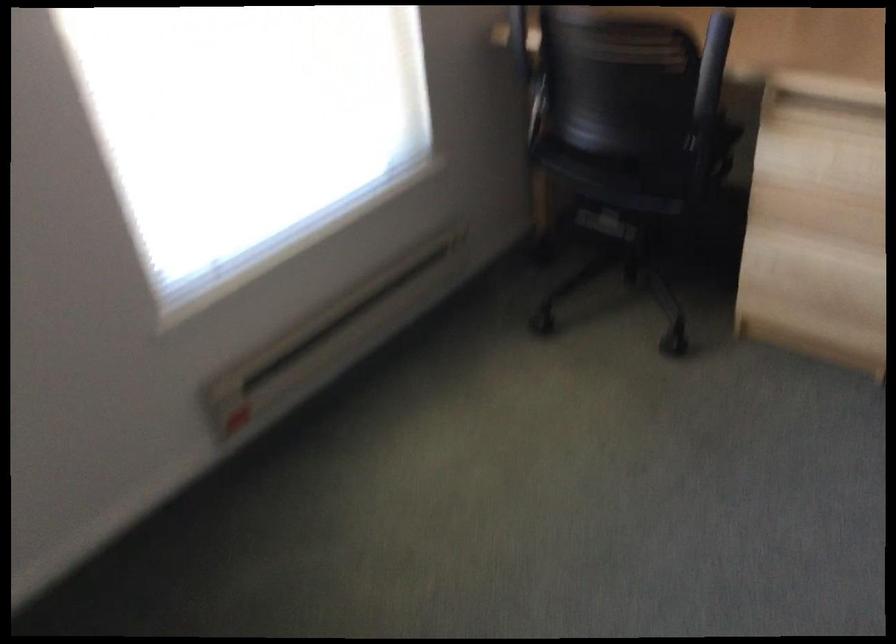
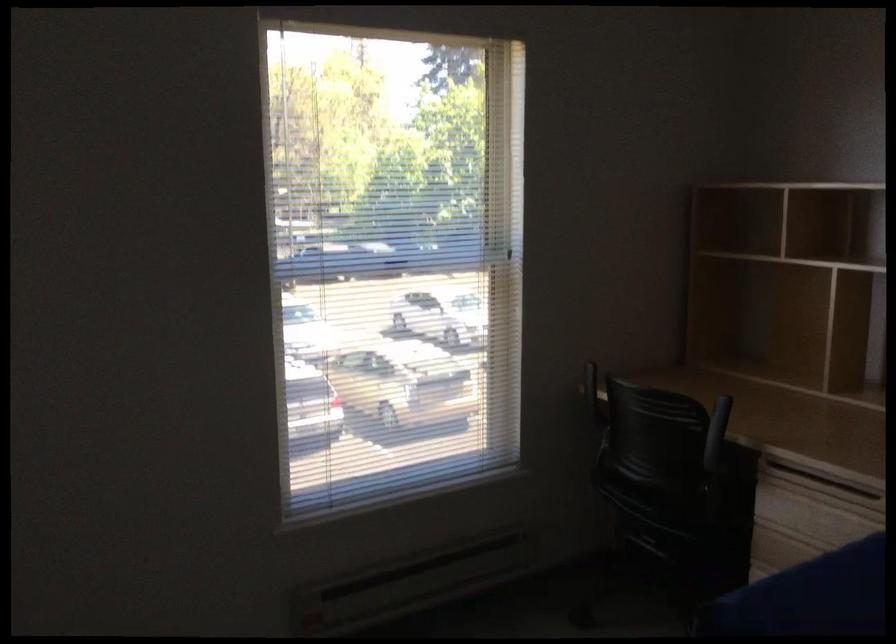
The images are taken continuously from a first-person perspective. In which direction is your viewpoint rotating?

The camera's rotation is toward left-up.